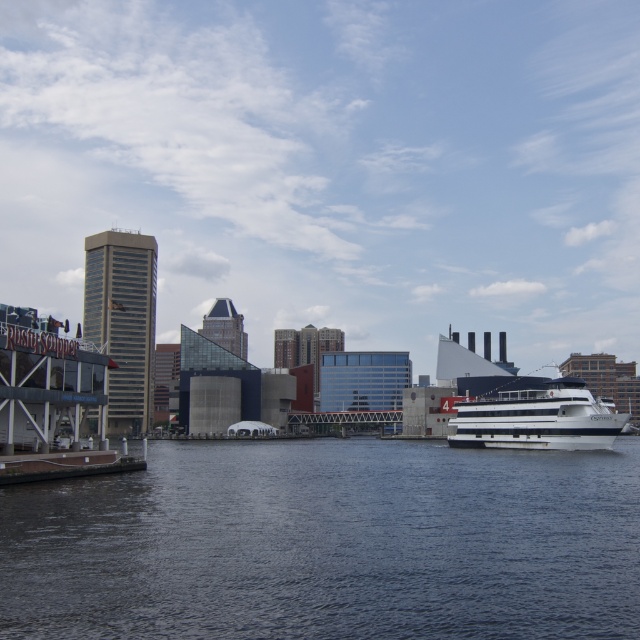
You are standing at the modern building with a glass facade and triangular roof on the left side of the image. You want to walk directly towards the point marked at coordinates (328, 544). Based on the scene description, will you have to cross any water to reach that point?

The point (328, 544) is on the dark blue water at center, so yes, you will have to cross water to reach it.

What are the coordinates of the dark blue water at center?

The coordinates of the dark blue water at center are (328, 544).